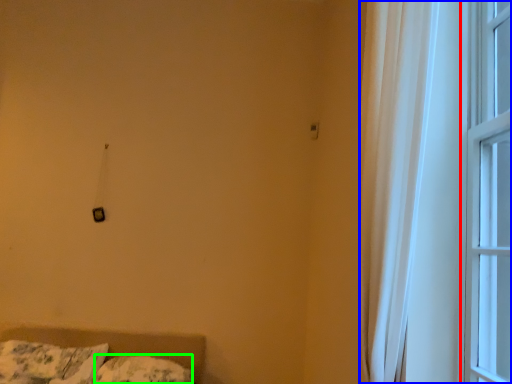
Question: Which object is the closest to the window (highlighted by a red box)? Choose among these: window (highlighted by a blue box) or pillow (highlighted by a green box).

Choices:
 (A) window
 (B) pillow

Answer: (A)